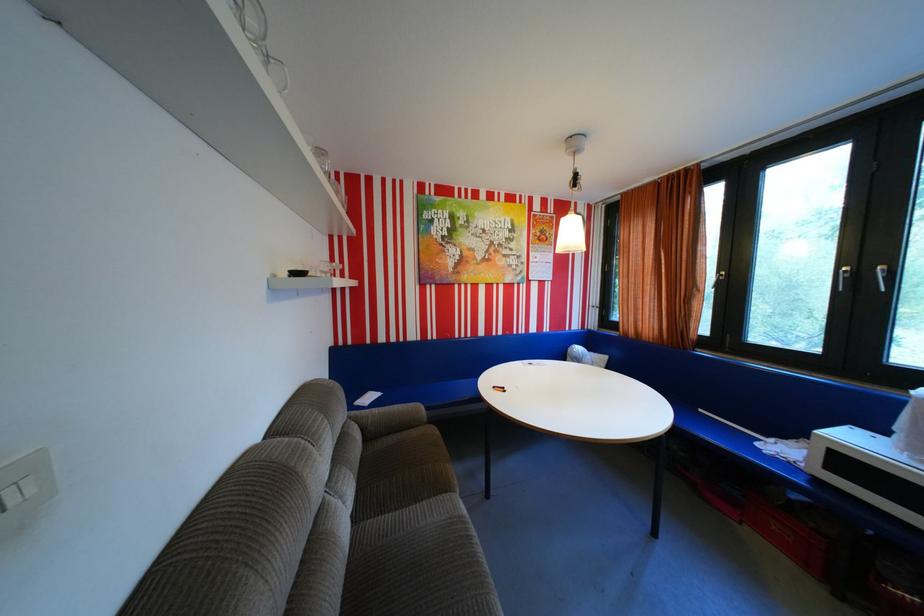
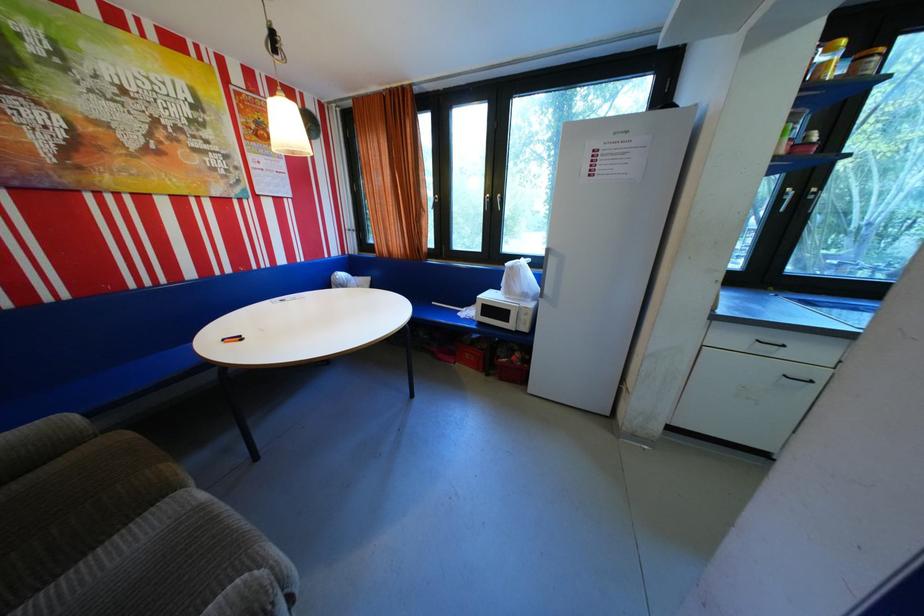
Locate, in the second image, the point that corresponds to point (797, 560) in the first image.

(483, 370)